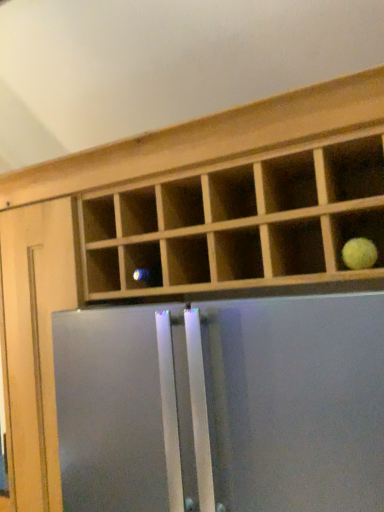
The width and height of the screenshot is (384, 512). Describe the element at coordinates (359, 254) in the screenshot. I see `yellow matte tennis ball at upper right` at that location.

At what (x,y) coordinates should I click in order to perform the action: click on yellow matte tennis ball at upper right. Please return your answer as a coordinate pair (x, y). The height and width of the screenshot is (512, 384). Looking at the image, I should click on (359, 254).

Identify the location of satin silver refrigerator at center. The height and width of the screenshot is (512, 384). (223, 405).

What do you see at coordinates (223, 405) in the screenshot?
I see `satin silver refrigerator at center` at bounding box center [223, 405].

Image resolution: width=384 pixels, height=512 pixels. What are the coordinates of `yellow matte tennis ball at upper right` in the screenshot? It's located at (359, 254).

Considering the positions of objects yellow matte tennis ball at upper right and satin silver refrigerator at center in the image provided, who is more to the right, yellow matte tennis ball at upper right or satin silver refrigerator at center?

yellow matte tennis ball at upper right is more to the right.

In the image, is yellow matte tennis ball at upper right positioned in front of or behind satin silver refrigerator at center?

Visually, yellow matte tennis ball at upper right is located behind satin silver refrigerator at center.

Considering the positions of point (375, 255) and point (117, 469), is point (375, 255) closer or farther from the camera than point (117, 469)?

Point (375, 255) is closer to the camera than point (117, 469).

From the image's perspective, is yellow matte tennis ball at upper right located above satin silver refrigerator at center?

Yes, from the image's perspective, yellow matte tennis ball at upper right is over satin silver refrigerator at center.

From a real-world perspective, is yellow matte tennis ball at upper right located beneath satin silver refrigerator at center?

No, from a real-world perspective, yellow matte tennis ball at upper right is not beneath satin silver refrigerator at center.

Considering the sizes of objects yellow matte tennis ball at upper right and satin silver refrigerator at center in the image provided, who is thinner, yellow matte tennis ball at upper right or satin silver refrigerator at center?

Thinner between the two is yellow matte tennis ball at upper right.

Considering the sizes of objects yellow matte tennis ball at upper right and satin silver refrigerator at center in the image provided, who is shorter, yellow matte tennis ball at upper right or satin silver refrigerator at center?

yellow matte tennis ball at upper right.

Who is bigger, yellow matte tennis ball at upper right or satin silver refrigerator at center?

satin silver refrigerator at center is bigger.

Is yellow matte tennis ball at upper right positioned beyond the bounds of satin silver refrigerator at center?

Absolutely, yellow matte tennis ball at upper right is external to satin silver refrigerator at center.

Are yellow matte tennis ball at upper right and satin silver refrigerator at center located far from each other?

No, there isn't a large distance between yellow matte tennis ball at upper right and satin silver refrigerator at center.

Could you tell me if yellow matte tennis ball at upper right is facing satin silver refrigerator at center?

No, yellow matte tennis ball at upper right is not oriented towards satin silver refrigerator at center.

You are a GUI agent. You are given a task and a screenshot of the screen. Output one action in this format:
    pyautogui.click(x=<x>, y=<y>)
    Task: Click on the fruit above the satin silver refrigerator at center (from a real-world perspective)
    
    Given the screenshot: What is the action you would take?
    pyautogui.click(x=359, y=254)

Is satin silver refrigerator at center to the left or to the right of yellow matte tennis ball at upper right in the image?

Clearly, satin silver refrigerator at center is on the left of yellow matte tennis ball at upper right in the image.

Is the position of satin silver refrigerator at center less distant than that of yellow matte tennis ball at upper right?

Yes, satin silver refrigerator at center is closer to the camera.

Which is behind, point (383, 385) or point (348, 250)?

Positioned behind is point (348, 250).

From the image's perspective, between satin silver refrigerator at center and yellow matte tennis ball at upper right, which one is located above?

yellow matte tennis ball at upper right is shown above in the image.

From a real-world perspective, is satin silver refrigerator at center located beneath yellow matte tennis ball at upper right?

Correct, in the physical world, satin silver refrigerator at center is lower than yellow matte tennis ball at upper right.

Considering the relative sizes of satin silver refrigerator at center and yellow matte tennis ball at upper right in the image provided, is satin silver refrigerator at center wider than yellow matte tennis ball at upper right?

Yes, satin silver refrigerator at center is wider than yellow matte tennis ball at upper right.

Is satin silver refrigerator at center shorter than yellow matte tennis ball at upper right?

No.

Considering the sizes of objects satin silver refrigerator at center and yellow matte tennis ball at upper right in the image provided, who is smaller, satin silver refrigerator at center or yellow matte tennis ball at upper right?

yellow matte tennis ball at upper right.

Is satin silver refrigerator at center spatially inside yellow matte tennis ball at upper right, or outside of it?

satin silver refrigerator at center is spatially situated outside yellow matte tennis ball at upper right.

Is satin silver refrigerator at center not close to yellow matte tennis ball at upper right?

Actually, satin silver refrigerator at center and yellow matte tennis ball at upper right are a little close together.

Is satin silver refrigerator at center positioned with its back to yellow matte tennis ball at upper right?

No, satin silver refrigerator at center is not facing away from yellow matte tennis ball at upper right.

How many degrees apart are the facing directions of satin silver refrigerator at center and yellow matte tennis ball at upper right?

The facing directions of satin silver refrigerator at center and yellow matte tennis ball at upper right are 0.047 degrees apart.

Measure the distance between satin silver refrigerator at center and yellow matte tennis ball at upper right.

17.83 inches.

Locate an element on the screen. screen door below the yellow matte tennis ball at upper right (from the image's perspective) is located at coordinates (223, 405).

The width and height of the screenshot is (384, 512). What are the coordinates of `screen door in front of the yellow matte tennis ball at upper right` in the screenshot? It's located at (223, 405).

Where is `fruit behind the satin silver refrigerator at center`? This screenshot has width=384, height=512. fruit behind the satin silver refrigerator at center is located at coordinates (359, 254).